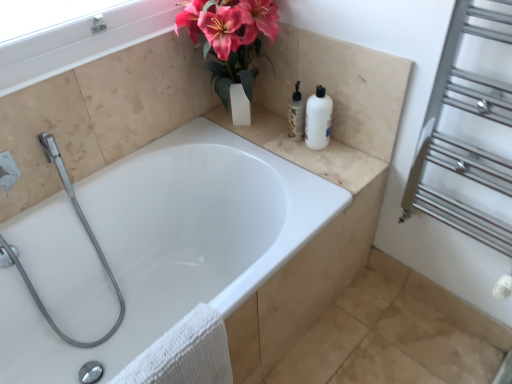
Question: In the image, is beige marble counter top at upper right positioned in front of or behind white textured towel at lower left?

Choices:
 (A) front
 (B) behind

Answer: (B)

Question: Is beige marble counter top at upper right spatially inside white textured towel at lower left, or outside of it?

Choices:
 (A) inside
 (B) outside

Answer: (B)

Question: Which is nearer to the white glossy bathtub at center?

Choices:
 (A) white glossy bottle at upper center
 (B) beige marble counter top at upper right
 (C) white textured towel at lower left
 (D) white plastic bottle at upper right
 (E) silver metallic towel rack at right

Answer: (B)

Question: Based on their relative distances, which object is nearer to the silver metallic towel rack at right?

Choices:
 (A) white plastic bottle at upper right
 (B) white glossy bathtub at center
 (C) white textured towel at lower left
 (D) beige marble counter top at upper right
 (E) white glossy bottle at upper center

Answer: (D)